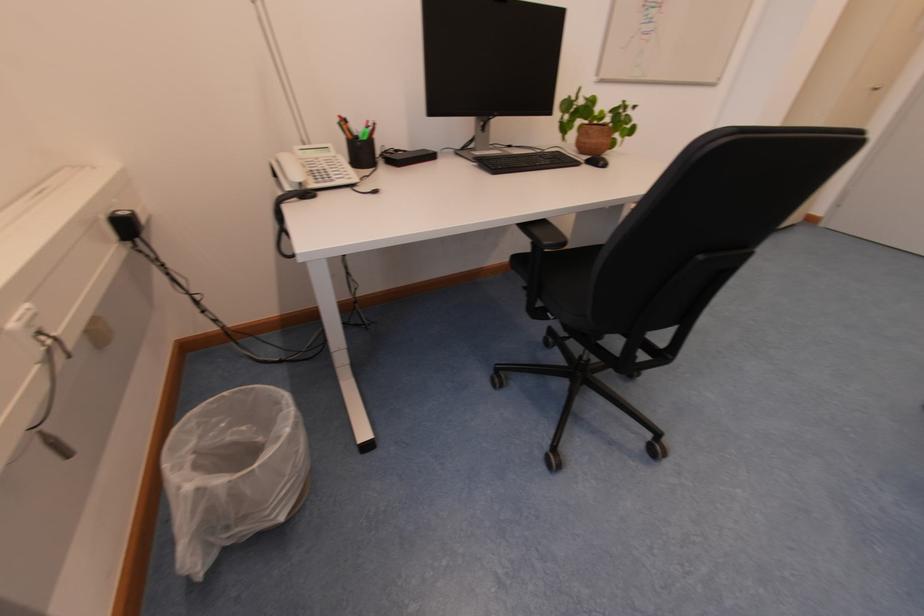
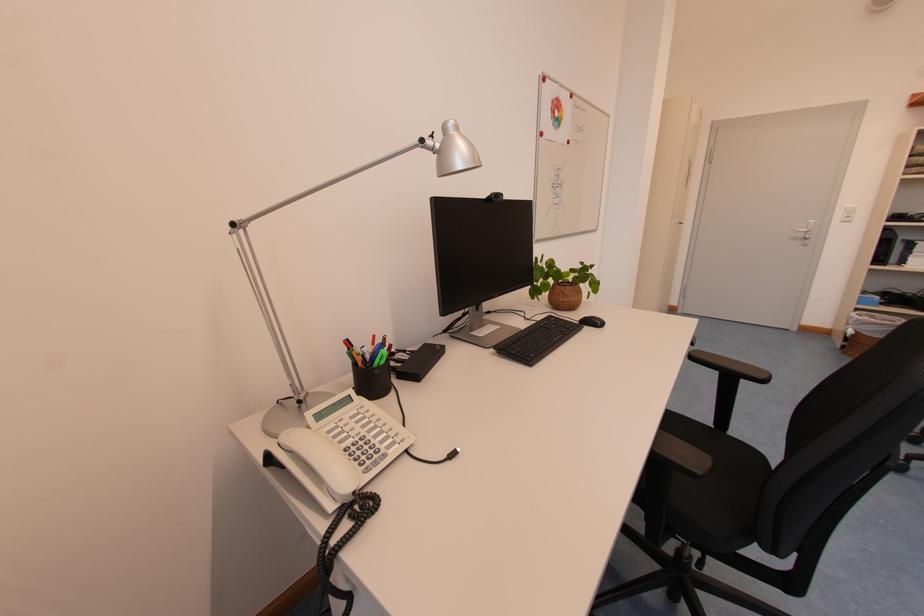
In a continuous first-person perspective shot, in which direction is the camera moving?

The cameraman moved toward left, forward.